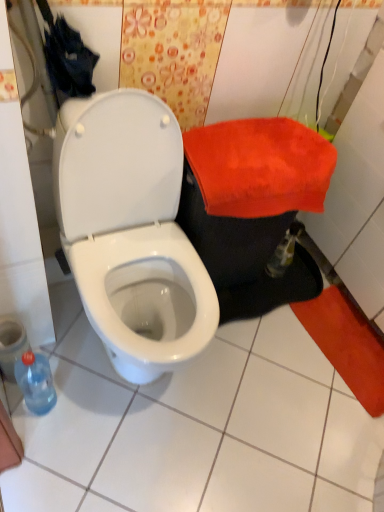
Measure the distance between point (x=176, y=295) and camera.

1.32 meters.

The image size is (384, 512). What do you see at coordinates (36, 382) in the screenshot?
I see `translucent plastic bottle at lower left` at bounding box center [36, 382].

You are a GUI agent. You are given a task and a screenshot of the screen. Output one action in this format:
    pyautogui.click(x=<x>, y=<y>)
    Task: Click on the white glossy toilet at center
    This screenshot has width=384, height=512.
    Given the screenshot: What is the action you would take?
    pyautogui.click(x=131, y=232)

Locate an element on the screen. This screenshot has width=384, height=512. bottle lying below the white glossy toilet at center (from the image's perspective) is located at coordinates pyautogui.click(x=36, y=382).

Between white glossy toilet at center and translucent plastic bottle at lower left, which one appears on the right side from the viewer's perspective?

Positioned to the right is white glossy toilet at center.

Is white glossy toilet at center not inside translucent plastic bottle at lower left?

Yes, white glossy toilet at center is located beyond the bounds of translucent plastic bottle at lower left.

How far apart are white glossy toilet at center and translucent plastic bottle at lower left?

white glossy toilet at center and translucent plastic bottle at lower left are 16.37 inches apart from each other.

Considering the sizes of objects translucent plastic bottle at lower left and red plush towel at right in the image provided, who is smaller, translucent plastic bottle at lower left or red plush towel at right?

translucent plastic bottle at lower left is smaller.

From a real-world perspective, is translucent plastic bottle at lower left above or below red plush towel at right?

In terms of real-world spatial position, translucent plastic bottle at lower left is below red plush towel at right.

Locate an element on the screen. The height and width of the screenshot is (512, 384). bottle below the red plush towel at right (from the image's perspective) is located at coordinates (36, 382).

Between translucent plastic bottle at lower left and red plush towel at right, which one has smaller width?

Thinner between the two is translucent plastic bottle at lower left.

Based on the photo, is red plush towel at right thinner than translucent plastic bottle at lower left?

Incorrect, the width of red plush towel at right is not less than that of translucent plastic bottle at lower left.

Is red plush towel at right facing towards translucent plastic bottle at lower left?

No, red plush towel at right is not aimed at translucent plastic bottle at lower left.

Which object is more forward, red plush towel at right or translucent plastic bottle at lower left?

translucent plastic bottle at lower left is more forward.

This screenshot has width=384, height=512. I want to click on toilet below the red plush towel at right (from the image's perspective), so click(x=131, y=232).

Consider the image. Is red plush towel at right inside the boundaries of white glossy toilet at center, or outside?

The correct answer is: outside.

Which object is further away from the camera, red plush towel at right or white glossy toilet at center?

red plush towel at right.

Is red plush towel at right turned away from white glossy toilet at center?

red plush towel at right does not have its back to white glossy toilet at center.

Could you tell me if white glossy toilet at center is turned towards red plush towel at right?

No, white glossy toilet at center does not turn towards red plush towel at right.

Does white glossy toilet at center appear on the left side of red plush towel at right?

Yes.

Considering the relative sizes of white glossy toilet at center and red plush towel at right in the image provided, is white glossy toilet at center bigger than red plush towel at right?

Yes.

From the image's perspective, which is below, white glossy toilet at center or red plush towel at right?

white glossy toilet at center, from the image's perspective.

From a real-world perspective, does translucent plastic bottle at lower left sit lower than white glossy toilet at center?

Yes, from a real-world perspective, translucent plastic bottle at lower left is beneath white glossy toilet at center.

In terms of width, does translucent plastic bottle at lower left look wider or thinner when compared to white glossy toilet at center?

Clearly, translucent plastic bottle at lower left has less width compared to white glossy toilet at center.

Between translucent plastic bottle at lower left and white glossy toilet at center, which one is positioned behind?

translucent plastic bottle at lower left is further away from the camera.

Measure the distance from translucent plastic bottle at lower left to white glossy toilet at center.

translucent plastic bottle at lower left is 16.37 inches from white glossy toilet at center.

Locate an element on the screen. bottle behind the white glossy toilet at center is located at coordinates (36, 382).

You are a GUI agent. You are given a task and a screenshot of the screen. Output one action in this format:
    pyautogui.click(x=<x>, y=<y>)
    Task: Click on the beach towel located above the translucent plastic bottle at lower left (from a real-world perspective)
    This screenshot has width=384, height=512.
    Given the screenshot: What is the action you would take?
    pyautogui.click(x=260, y=167)

When comparing their distances from red plush towel at right, does white glossy toilet at center or translucent plastic bottle at lower left seem closer?

white glossy toilet at center lies closer to red plush towel at right than the other object.

Looking at the image, which one is located further to red plush towel at right, translucent plastic bottle at lower left or white glossy toilet at center?

The object further to red plush towel at right is translucent plastic bottle at lower left.

Considering their positions, is translucent plastic bottle at lower left positioned further to white glossy toilet at center than red plush towel at right?

Based on the image, translucent plastic bottle at lower left appears to be further to white glossy toilet at center.

In the scene shown: Estimate the real-world distances between objects in this image. Which object is closer to translucent plastic bottle at lower left, red plush towel at right or white glossy toilet at center?

white glossy toilet at center is positioned closer to the anchor translucent plastic bottle at lower left.

Considering their positions, is white glossy toilet at center positioned closer to translucent plastic bottle at lower left than red plush towel at right?

Among the two, white glossy toilet at center is located nearer to translucent plastic bottle at lower left.

When comparing their distances from white glossy toilet at center, does red plush towel at right or translucent plastic bottle at lower left seem closer?

red plush towel at right.

Where is `toilet between translucent plastic bottle at lower left and red plush towel at right`? The image size is (384, 512). toilet between translucent plastic bottle at lower left and red plush towel at right is located at coordinates (131, 232).